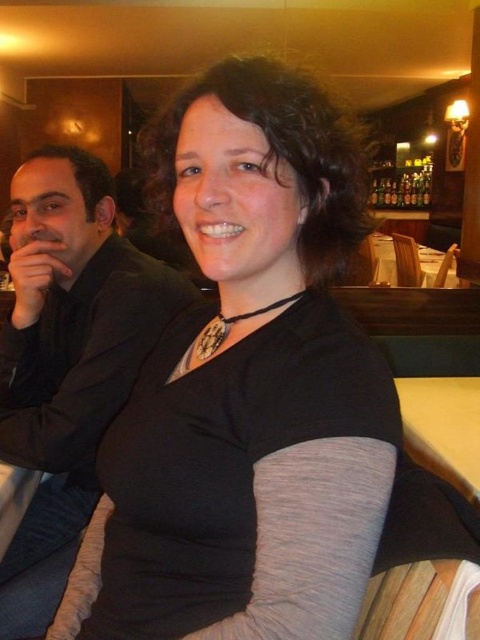
Can you confirm if black matte suit at left is bigger than yellow wood table at center?

Indeed, black matte suit at left has a larger size compared to yellow wood table at center.

Is point (16, 628) farther from camera compared to point (471, 380)?

No, (16, 628) is in front of (471, 380).

Where is `black matte suit at left`? The height and width of the screenshot is (640, 480). black matte suit at left is located at coordinates (69, 353).